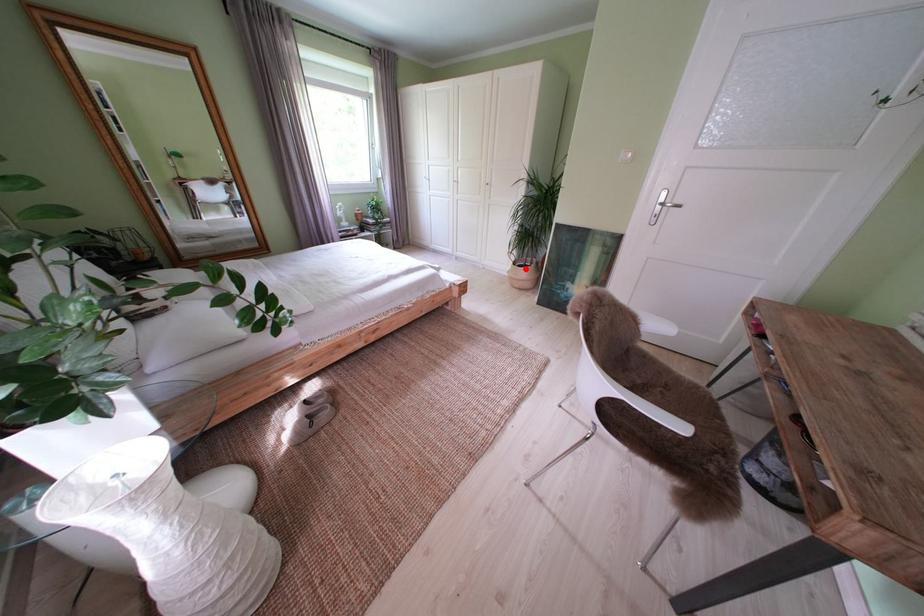
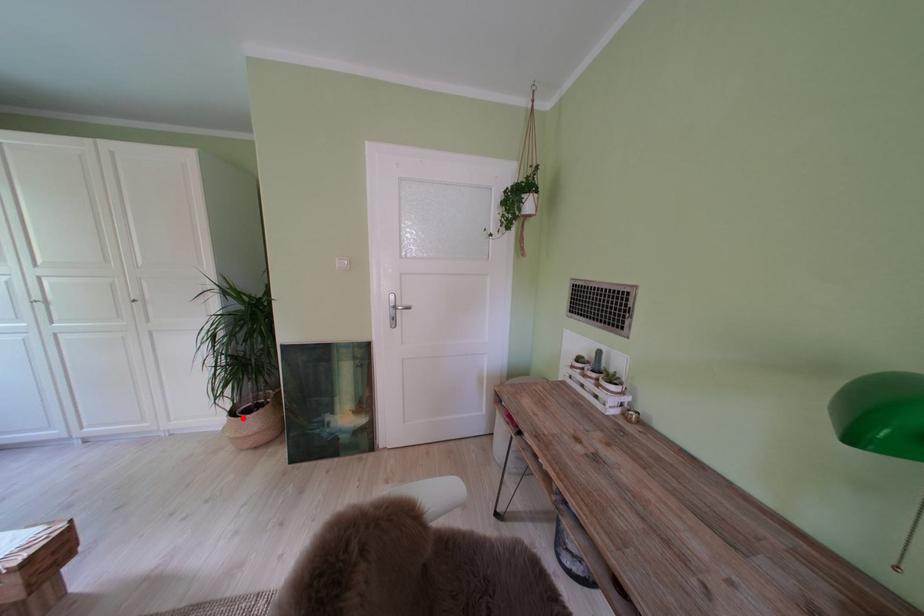
I am providing you with two images of the same scene from different viewpoints. A red point is marked on the first image and another point is marked on the second image. Do the highlighted points in image1 and image2 indicate the same real-world spot?

Yes